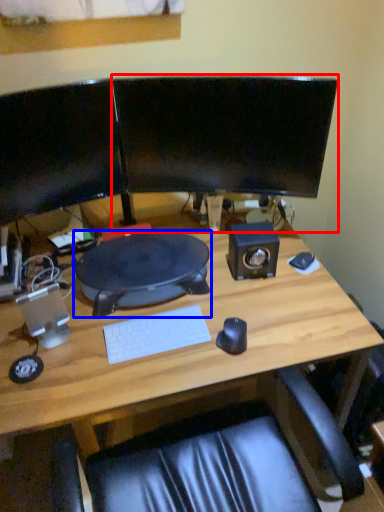
Question: Which object is further to the camera taking this photo, computer monitor (highlighted by a red box) or desktop (highlighted by a blue box)?

Choices:
 (A) computer monitor
 (B) desktop

Answer: (B)